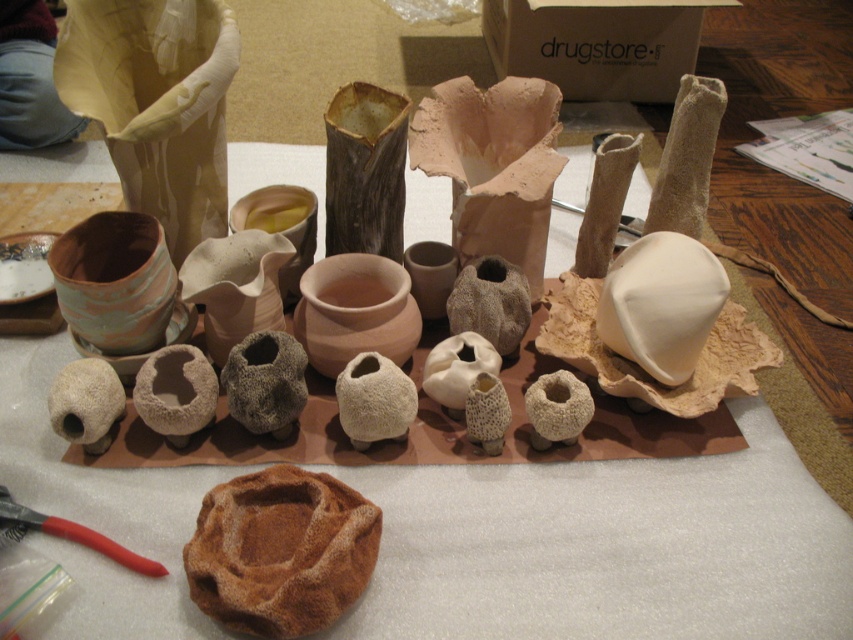
Question: Is matte clay vase at upper left above matte clay vase at center?

Choices:
 (A) yes
 (B) no

Answer: (A)

Question: Is the position of matte clay vase at center more distant than that of brown matte vase at center?

Choices:
 (A) no
 (B) yes

Answer: (A)

Question: Estimate the real-world distances between objects in this image. Which object is farther from the matte clay vase at upper left?

Choices:
 (A) brown matte vase at center
 (B) matte clay pot at center
 (C) rubber handle pliers at lower left
 (D) terracotta clay pot at center-left

Answer: (C)

Question: Which point is farther from the camera taking this photo?

Choices:
 (A) (115, 276)
 (B) (345, 289)
 (C) (357, 106)

Answer: (C)

Question: Can you confirm if matte clay vase at upper left is smaller than terracotta clay pot at center-left?

Choices:
 (A) yes
 (B) no

Answer: (B)

Question: Which of these objects is positioned closest to the matte clay vase at center?

Choices:
 (A) terracotta clay pot at center-left
 (B) matte clay vase at upper left

Answer: (B)